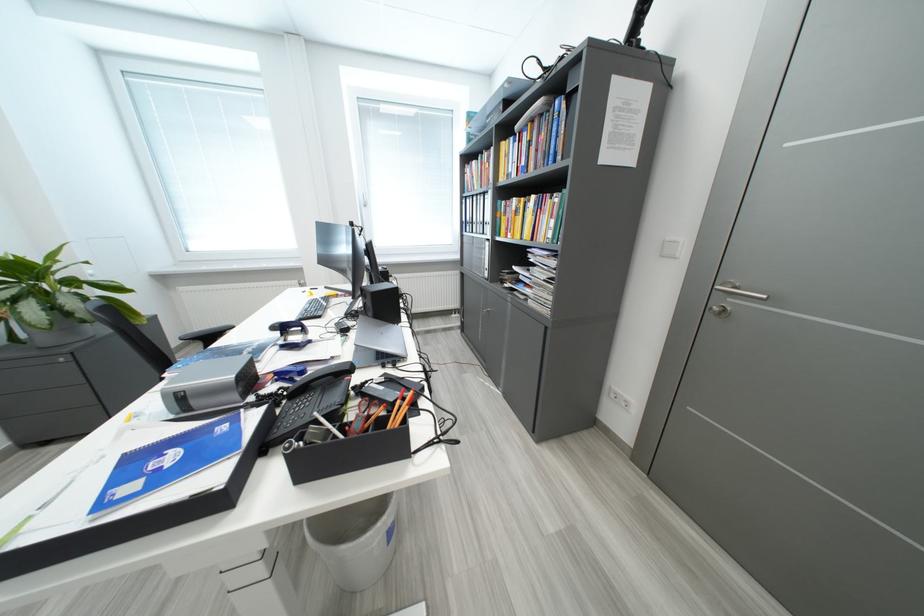
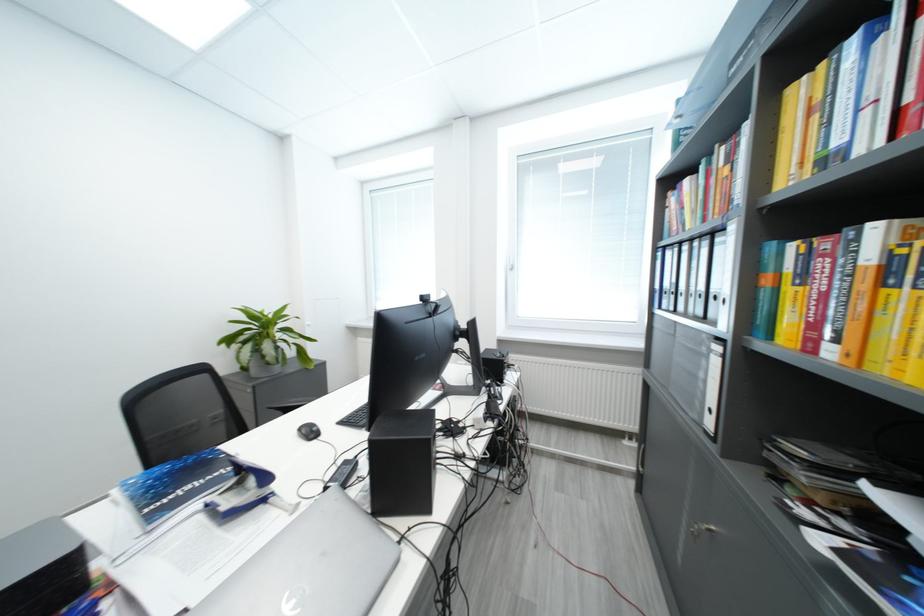
The point at (520, 142) is marked in the first image. Where is the corresponding point in the second image?

(861, 44)